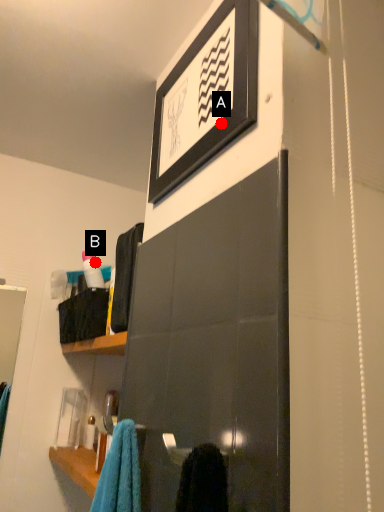
Question: Two points are circled on the image, labeled by A and B beside each circle. Among these points, which one is nearest to the camera?

Choices:
 (A) A is closer
 (B) B is closer

Answer: (A)